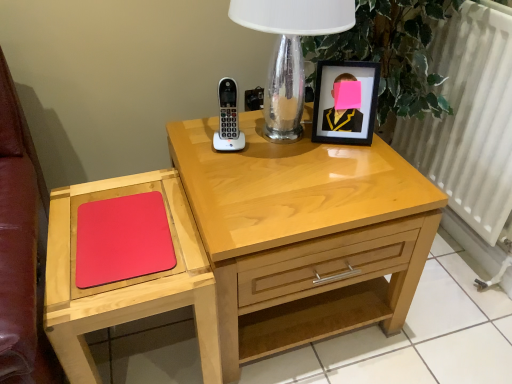
Where is `vacant area situated below matte wood mouse pad at left (from a real-world perspective)`? vacant area situated below matte wood mouse pad at left (from a real-world perspective) is located at coordinates (155, 349).